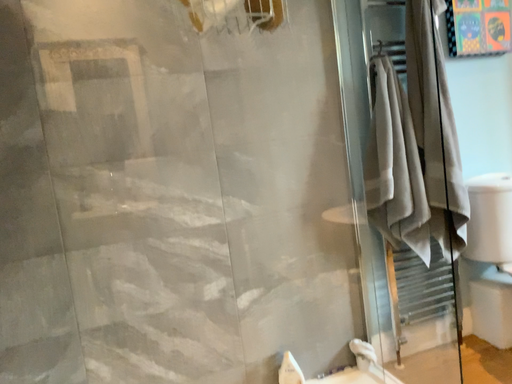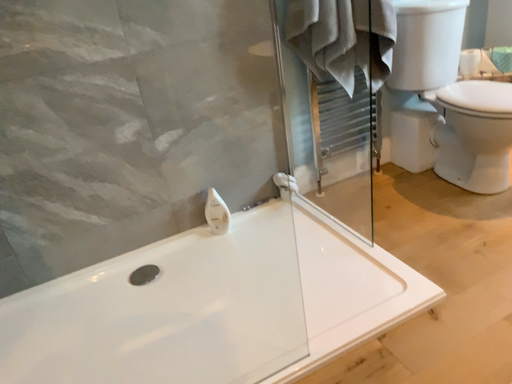
Question: How did the camera likely rotate when shooting the video?

Choices:
 (A) rotated downward
 (B) rotated upward

Answer: (A)